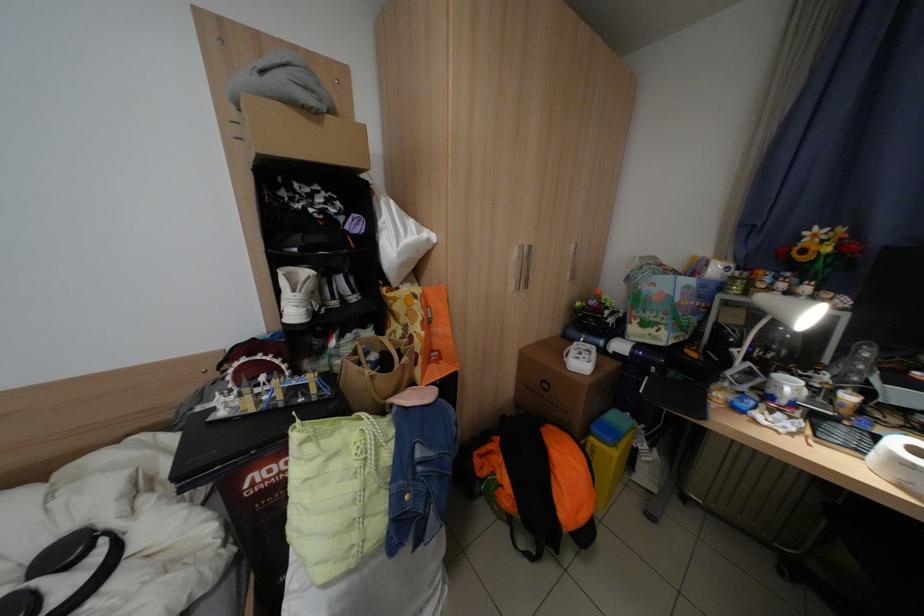
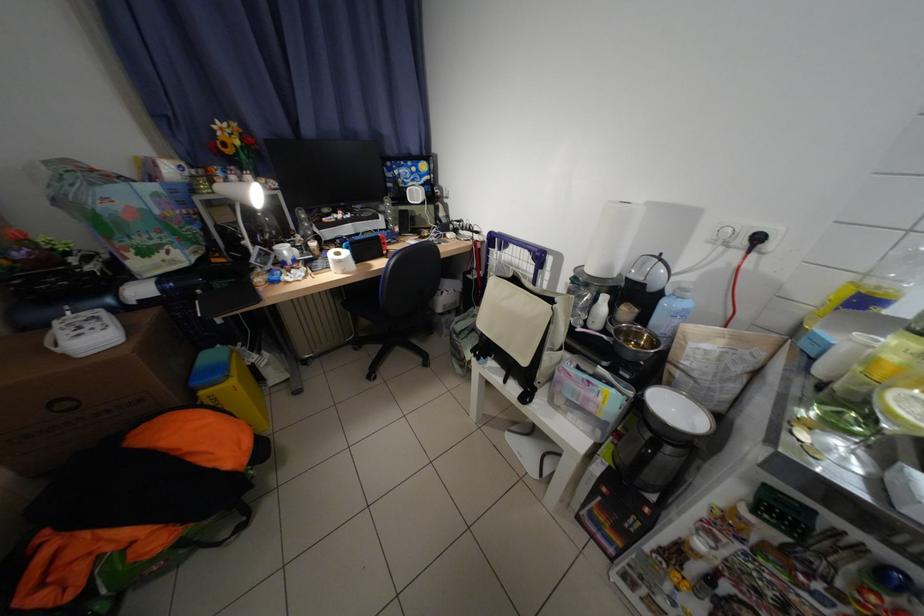
The images are taken continuously from a first-person perspective. In which direction is your viewpoint rotating?

The camera's rotation is toward right-down.